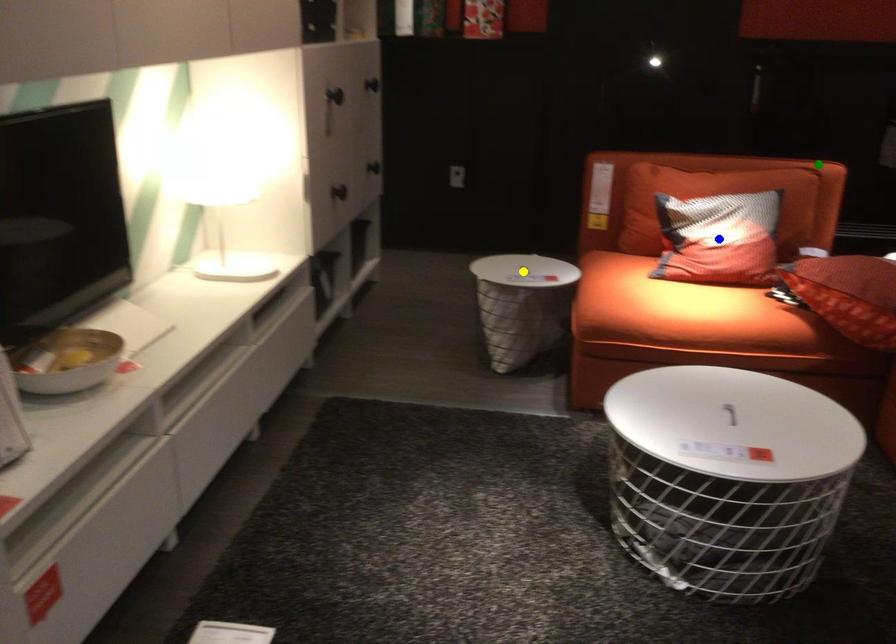
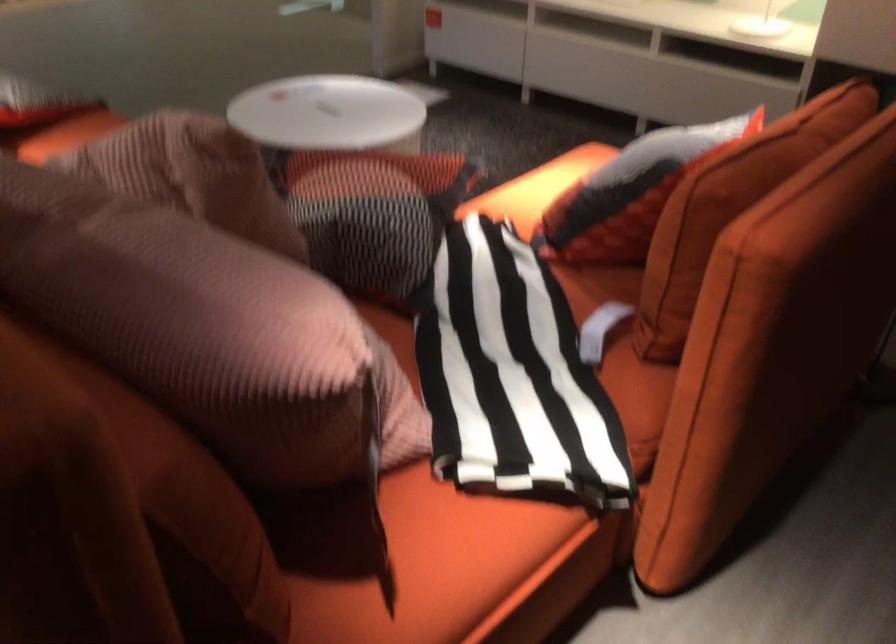
I am providing you with two images of the same scene from different viewpoints. Three points are marked in image1. Which point corresponds to a part or object that is occluded in image2?In image1, three points are marked. Which of them correspond to a part or object that is occluded in image2?Among the three points shown in image1, which one corresponds to a part or object that is no longer visible due to occlusion in image2?

blue point, yellow point